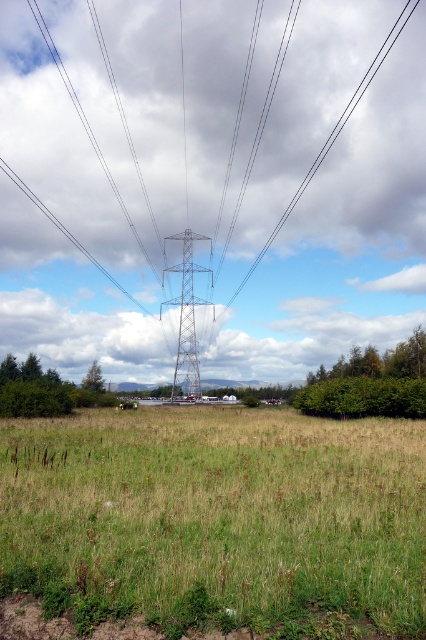
Question: Can you confirm if green grassy field at center is positioned above metallic silver tower at center?

Choices:
 (A) no
 (B) yes

Answer: (A)

Question: From the image, what is the correct spatial relationship of green grassy field at center in relation to metallic silver tower at center?

Choices:
 (A) below
 (B) above

Answer: (A)

Question: Among these objects, which one is farthest from the camera?

Choices:
 (A) green grassy field at center
 (B) metallic silver tower at center

Answer: (B)

Question: Is green grassy field at center bigger than metallic silver tower at center?

Choices:
 (A) no
 (B) yes

Answer: (A)